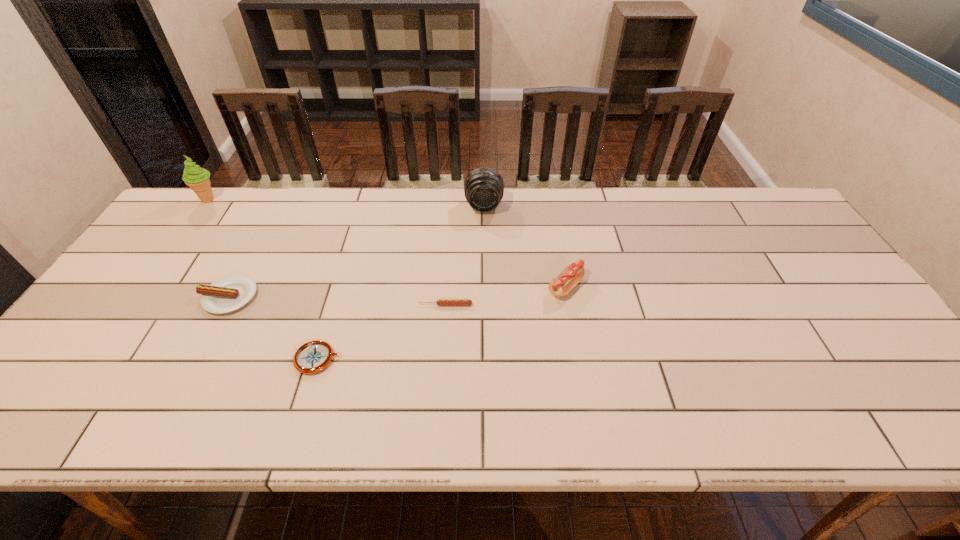
Locate an element on the screen. This screenshot has height=540, width=960. object at the far left corner is located at coordinates [x=197, y=178].

Where is `blank space at the far edge of the desktop`? blank space at the far edge of the desktop is located at coordinates (466, 210).

Find the location of a particular element. This screenshot has width=960, height=540. vacant area at the near edge of the desktop is located at coordinates (522, 413).

In the image, there is a desktop. What are the coordinates of `vacant space at the right edge` in the screenshot? It's located at (821, 276).

In the image, there is a desktop. Identify the location of free space at the far left corner. The width and height of the screenshot is (960, 540). (234, 199).

You are a GUI agent. You are given a task and a screenshot of the screen. Output one action in this format:
    pyautogui.click(x=<x>, y=<y>)
    Task: Click on the vacant point located between the telephoto lens and the leftmost sausage
    This screenshot has height=540, width=960.
    Given the screenshot: What is the action you would take?
    [x=356, y=251]

Identify the location of free space between the third object from left to right and the tallest sausage. Image resolution: width=960 pixels, height=540 pixels. (442, 323).

The image size is (960, 540). Identify the location of empty space that is in between the tallest object and the fourth shortest object. (387, 243).

You are a GUI agent. You are given a task and a screenshot of the screen. Output one action in this format:
    pyautogui.click(x=<x>, y=<y>)
    Task: Click on the unoccupied area between the shortest sausage and the second shortest sausage
    
    Given the screenshot: What is the action you would take?
    pyautogui.click(x=337, y=301)

At what (x,y) coordinates should I click in order to perform the action: click on free point between the second object from left to right and the shortest sausage. Please return your answer as a coordinate pair (x, y). Looking at the image, I should click on (337, 301).